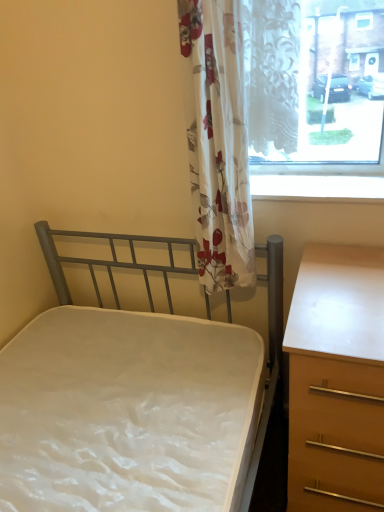
Locate an element on the screen. free spot above light brown wood chest of drawers at right (from a real-world perspective) is located at coordinates (343, 287).